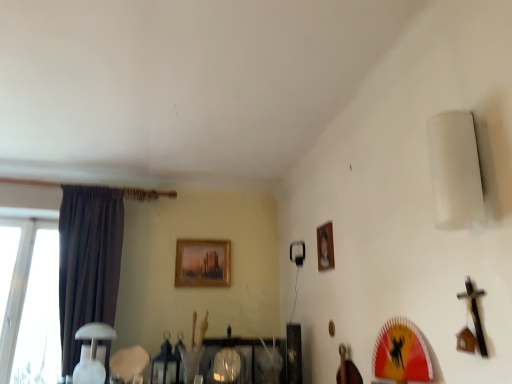
What is the approximate width of wooden framed painting at upper center, placed as the first picture frame when sorted from left to right?

1.52 inches.

Describe the element at coordinates (92, 353) in the screenshot. The width and height of the screenshot is (512, 384). I see `white glossy table lamp at lower left` at that location.

You are a GUI agent. You are given a task and a screenshot of the screen. Output one action in this format:
    pyautogui.click(x=<x>, y=<y>)
    Task: Click on the wooden framed painting at upper center, the second picture frame from the right
    Image resolution: width=512 pixels, height=384 pixels.
    Given the screenshot: What is the action you would take?
    pyautogui.click(x=203, y=263)

The image size is (512, 384). In order to click on the 2nd picture frame above the dark fabric curtain at left (from the image's perspective) in this screenshot , I will do `click(325, 247)`.

Between dark fabric curtain at left and wooden picture frame at upper center, the 1th picture frame in the right-to-left sequence, which one is positioned behind?

dark fabric curtain at left is behind.

Is dark fabric curtain at left positioned beyond the bounds of wooden picture frame at upper center, which appears as the 2th picture frame when viewed from the back?

Yes, dark fabric curtain at left is outside of wooden picture frame at upper center, which appears as the 2th picture frame when viewed from the back.

Does wooden framed painting at upper center, which is counted as the first picture frame, starting from the back, have a smaller size compared to dark fabric curtain at left?

Yes.

Considering the positions of objects wooden framed painting at upper center, the 2th picture frame from the front, and dark fabric curtain at left in the image provided, who is more to the left, wooden framed painting at upper center, the 2th picture frame from the front, or dark fabric curtain at left?

dark fabric curtain at left.

Does wooden framed painting at upper center, placed as the first picture frame when sorted from left to right, have a lesser width compared to dark fabric curtain at left?

Indeed, wooden framed painting at upper center, placed as the first picture frame when sorted from left to right, has a lesser width compared to dark fabric curtain at left.

From a real-world perspective, is wooden framed painting at upper center, which is counted as the first picture frame, starting from the back, positioned over dark fabric curtain at left based on gravity?

Yes, from a real-world perspective, wooden framed painting at upper center, which is counted as the first picture frame, starting from the back, is on top of dark fabric curtain at left.

Are wooden framed painting at upper center, placed as the first picture frame when sorted from left to right, and white glossy table lamp at lower left far apart?

No.

From the image's perspective, is wooden framed painting at upper center, placed as the first picture frame when sorted from left to right, on white glossy table lamp at lower left?

Yes, from the image's perspective, wooden framed painting at upper center, placed as the first picture frame when sorted from left to right, is above white glossy table lamp at lower left.

Which is in front, wooden framed painting at upper center, placed as the first picture frame when sorted from left to right, or white glossy table lamp at lower left?

white glossy table lamp at lower left is more forward.

Considering the sizes of objects wooden picture frame at upper center, the first picture frame when ordered from front to back, and white glossy table lamp at lower left in the image provided, who is taller, wooden picture frame at upper center, the first picture frame when ordered from front to back, or white glossy table lamp at lower left?

white glossy table lamp at lower left.

Is wooden picture frame at upper center, which appears as the 2th picture frame when viewed from the back, touching white glossy table lamp at lower left?

wooden picture frame at upper center, which appears as the 2th picture frame when viewed from the back, is not next to white glossy table lamp at lower left, and they're not touching.

From a real-world perspective, which is physically below, wooden picture frame at upper center, the first picture frame when ordered from front to back, or white glossy table lamp at lower left?

In real-world perspective, white glossy table lamp at lower left is lower.

Between wooden picture frame at upper center, the first picture frame when ordered from front to back, and white glossy table lamp at lower left, which one has smaller size?

wooden picture frame at upper center, the first picture frame when ordered from front to back.

Which is in front, wooden framed painting at upper center, placed as the first picture frame when sorted from left to right, or wooden picture frame at upper center, the first picture frame when ordered from front to back?

wooden picture frame at upper center, the first picture frame when ordered from front to back, is in front.

Considering the relative sizes of wooden framed painting at upper center, the 2th picture frame from the front, and wooden picture frame at upper center, placed as the second picture frame when sorted from left to right, in the image provided, is wooden framed painting at upper center, the 2th picture frame from the front, taller than wooden picture frame at upper center, placed as the second picture frame when sorted from left to right,?

Correct, wooden framed painting at upper center, the 2th picture frame from the front, is much taller as wooden picture frame at upper center, placed as the second picture frame when sorted from left to right.

How many degrees apart are the facing directions of wooden framed painting at upper center, placed as the first picture frame when sorted from left to right, and wooden picture frame at upper center, which appears as the 2th picture frame when viewed from the back?

90.5 degrees separate the facing orientations of wooden framed painting at upper center, placed as the first picture frame when sorted from left to right, and wooden picture frame at upper center, which appears as the 2th picture frame when viewed from the back.

Does wooden framed painting at upper center, the second picture frame from the right, have a smaller size compared to wooden picture frame at upper center, which appears as the 2th picture frame when viewed from the back?

Actually, wooden framed painting at upper center, the second picture frame from the right, might be larger than wooden picture frame at upper center, which appears as the 2th picture frame when viewed from the back.

Is the position of dark fabric curtain at left less distant than that of white glossy table lamp at lower left?

That is False.

Is dark fabric curtain at left oriented towards white glossy table lamp at lower left?

Yes.

Considering the positions of point (120, 259) and point (92, 378), is point (120, 259) closer or farther from the camera than point (92, 378)?

Point (120, 259) is positioned farther from the camera compared to point (92, 378).

From a real-world perspective, is dark fabric curtain at left on top of white glossy table lamp at lower left?

Yes, from a real-world perspective, dark fabric curtain at left is above white glossy table lamp at lower left.

Considering the sizes of objects wooden picture frame at upper center, which appears as the 2th picture frame when viewed from the back, and wooden framed painting at upper center, which is counted as the first picture frame, starting from the back, in the image provided, who is thinner, wooden picture frame at upper center, which appears as the 2th picture frame when viewed from the back, or wooden framed painting at upper center, which is counted as the first picture frame, starting from the back,?

With smaller width is wooden picture frame at upper center, which appears as the 2th picture frame when viewed from the back.

Is wooden picture frame at upper center, the first picture frame when ordered from front to back, oriented away from wooden framed painting at upper center, the second picture frame from the right?

No, wooden framed painting at upper center, the second picture frame from the right, is not at the back of wooden picture frame at upper center, the first picture frame when ordered from front to back.

Considering the sizes of objects wooden picture frame at upper center, the first picture frame when ordered from front to back, and wooden framed painting at upper center, the 2th picture frame from the front, in the image provided, who is bigger, wooden picture frame at upper center, the first picture frame when ordered from front to back, or wooden framed painting at upper center, the 2th picture frame from the front,?

wooden framed painting at upper center, the 2th picture frame from the front.

Locate an element on the screen. This screenshot has height=384, width=512. curtain that is behind the wooden picture frame at upper center, the 1th picture frame in the right-to-left sequence is located at coordinates (88, 262).

I want to click on curtain below the wooden framed painting at upper center, placed as the first picture frame when sorted from left to right (from a real-world perspective), so [x=88, y=262].

Which object lies further to the anchor point wooden framed painting at upper center, the second picture frame from the right, wooden picture frame at upper center, which appears as the 2th picture frame when viewed from the back, or dark fabric curtain at left?

wooden picture frame at upper center, which appears as the 2th picture frame when viewed from the back, is positioned further to the anchor wooden framed painting at upper center, the second picture frame from the right.

When comparing their distances from dark fabric curtain at left, does wooden framed painting at upper center, placed as the first picture frame when sorted from left to right, or wooden picture frame at upper center, the 1th picture frame in the right-to-left sequence, seem further?

The object further to dark fabric curtain at left is wooden picture frame at upper center, the 1th picture frame in the right-to-left sequence.

Looking at the image, which one is located further to wooden picture frame at upper center, the 1th picture frame in the right-to-left sequence, wooden framed painting at upper center, the 2th picture frame from the front, or dark fabric curtain at left?

dark fabric curtain at left is further to wooden picture frame at upper center, the 1th picture frame in the right-to-left sequence.

Estimate the real-world distances between objects in this image. Which object is closer to wooden framed painting at upper center, the 2th picture frame from the front, dark fabric curtain at left or wooden picture frame at upper center, the 1th picture frame in the right-to-left sequence?

dark fabric curtain at left is closer to wooden framed painting at upper center, the 2th picture frame from the front.

Based on their spatial positions, is wooden picture frame at upper center, placed as the second picture frame when sorted from left to right, or wooden framed painting at upper center, the second picture frame from the right, further from white glossy table lamp at lower left?

Among the two, wooden picture frame at upper center, placed as the second picture frame when sorted from left to right, is located further to white glossy table lamp at lower left.

Estimate the real-world distances between objects in this image. Which object is further from white glossy table lamp at lower left, wooden framed painting at upper center, the 2th picture frame from the front, or wooden picture frame at upper center, the 1th picture frame in the right-to-left sequence?

wooden picture frame at upper center, the 1th picture frame in the right-to-left sequence, is positioned further to the anchor white glossy table lamp at lower left.

Based on their spatial positions, is white glossy table lamp at lower left or dark fabric curtain at left closer to wooden picture frame at upper center, the 1th picture frame in the right-to-left sequence?

white glossy table lamp at lower left.

Looking at the image, which one is located closer to white glossy table lamp at lower left, dark fabric curtain at left or wooden framed painting at upper center, the 2th picture frame from the front?

The object closer to white glossy table lamp at lower left is dark fabric curtain at left.

Find the location of `curtain between white glossy table lamp at lower left and wooden framed painting at upper center, the 2th picture frame from the front, in the front-back direction`. curtain between white glossy table lamp at lower left and wooden framed painting at upper center, the 2th picture frame from the front, in the front-back direction is located at coordinates (88, 262).

Locate an element on the screen. The width and height of the screenshot is (512, 384). picture frame between white glossy table lamp at lower left and wooden picture frame at upper center, the 1th picture frame in the right-to-left sequence, from left to right is located at coordinates (203, 263).

Find the location of a particular element. The width and height of the screenshot is (512, 384). table lamp situated between dark fabric curtain at left and wooden picture frame at upper center, the 1th picture frame in the right-to-left sequence, from left to right is located at coordinates (92, 353).

At what (x,y) coordinates should I click in order to perform the action: click on picture frame located between dark fabric curtain at left and wooden picture frame at upper center, placed as the second picture frame when sorted from left to right, in the left-right direction. Please return your answer as a coordinate pair (x, y). The height and width of the screenshot is (384, 512). Looking at the image, I should click on (203, 263).